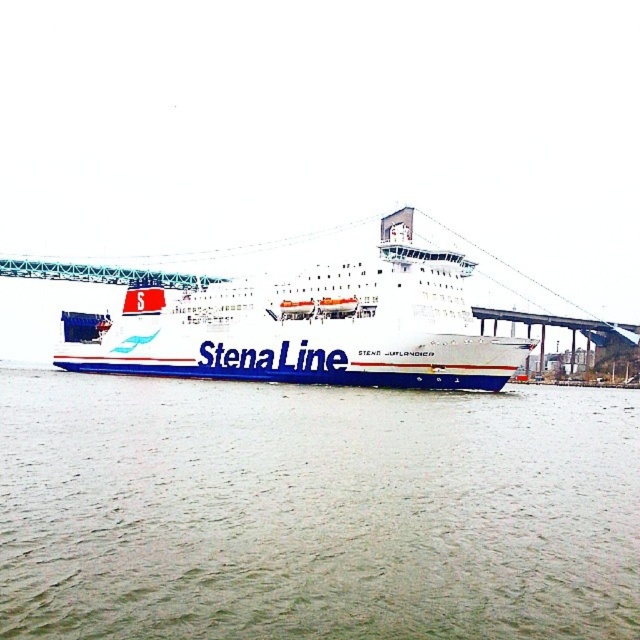
Question: Among these objects, which one is nearest to the camera?

Choices:
 (A) green water at center
 (B) white matte ship at center

Answer: (A)

Question: Which point is farther from the camera taking this photo?

Choices:
 (A) (628, 429)
 (B) (408, 368)

Answer: (B)

Question: Is green water at center wider than white matte ship at center?

Choices:
 (A) no
 (B) yes

Answer: (A)

Question: Is green water at center in front of white matte ship at center?

Choices:
 (A) no
 (B) yes

Answer: (B)

Question: Which point is closer to the camera?

Choices:
 (A) green water at center
 (B) white matte ship at center

Answer: (A)

Question: Does green water at center appear over white matte ship at center?

Choices:
 (A) no
 (B) yes

Answer: (A)